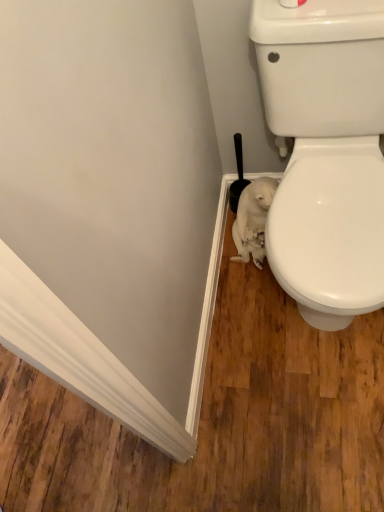
Question: Based on their positions, is black plastic brush at lower right located to the left or right of white fur animal at lower right?

Choices:
 (A) right
 (B) left

Answer: (B)

Question: In the image, is black plastic brush at lower right positioned in front of or behind white fur animal at lower right?

Choices:
 (A) behind
 (B) front

Answer: (A)

Question: From a real-world perspective, is black plastic brush at lower right physically located above or below white fur animal at lower right?

Choices:
 (A) above
 (B) below

Answer: (A)

Question: In the image, is white fur animal at lower right positioned in front of or behind black plastic brush at lower right?

Choices:
 (A) front
 (B) behind

Answer: (A)

Question: From a real-world perspective, is white fur animal at lower right physically located above or below black plastic brush at lower right?

Choices:
 (A) above
 (B) below

Answer: (B)

Question: Is white fur animal at lower right spatially inside black plastic brush at lower right, or outside of it?

Choices:
 (A) inside
 (B) outside

Answer: (B)

Question: Considering the positions of white fur animal at lower right and black plastic brush at lower right in the image, is white fur animal at lower right wider or thinner than black plastic brush at lower right?

Choices:
 (A) wide
 (B) thin

Answer: (A)